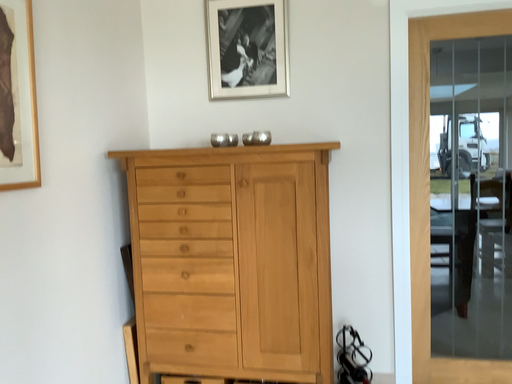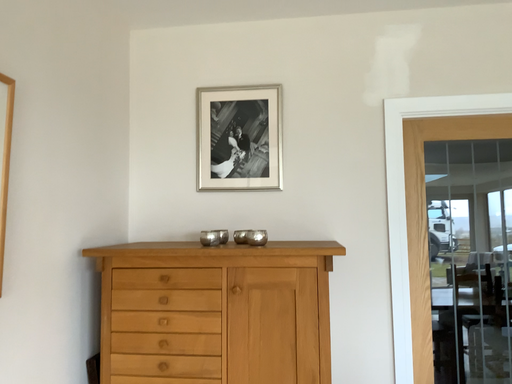
Question: Which way did the camera rotate in the video?

Choices:
 (A) rotated upward
 (B) rotated downward

Answer: (A)